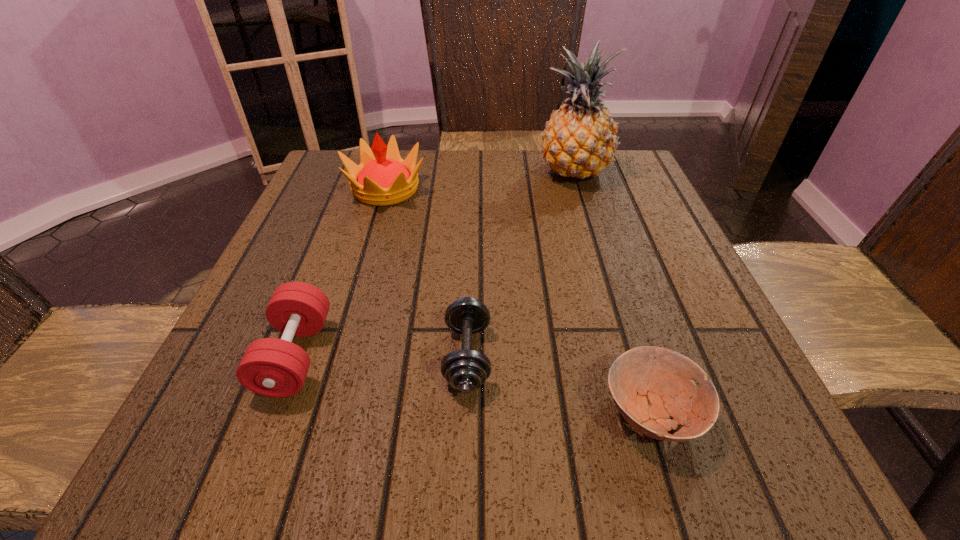
What are the coordinates of `free space that satisfies the following two spatial constraints: 1. on the back side of the tallest object; 2. on the right side of the third object from left to right` in the screenshot? It's located at (472, 173).

In order to click on free location that satisfies the following two spatial constraints: 1. on the front side of the fourth shortest object; 2. on the left side of the right dumbbell in this screenshot , I will do pos(337,356).